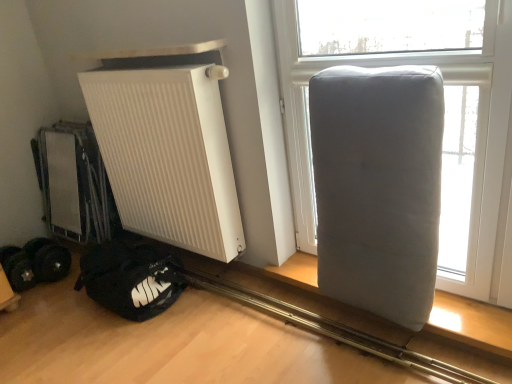
Question: Does white matte radiator at left appear on the right side of gray fabric cushion at right?

Choices:
 (A) no
 (B) yes

Answer: (A)

Question: Considering the relative sizes of white matte radiator at left and gray fabric cushion at right in the image provided, is white matte radiator at left thinner than gray fabric cushion at right?

Choices:
 (A) yes
 (B) no

Answer: (B)

Question: Is gray fabric cushion at right located within white matte radiator at left?

Choices:
 (A) yes
 (B) no

Answer: (B)

Question: From a real-world perspective, does white matte radiator at left stand above gray fabric cushion at right?

Choices:
 (A) yes
 (B) no

Answer: (B)

Question: Is white matte radiator at left positioned far away from gray fabric cushion at right?

Choices:
 (A) no
 (B) yes

Answer: (A)

Question: Is white matte radiator at left smaller than gray fabric cushion at right?

Choices:
 (A) no
 (B) yes

Answer: (A)

Question: Considering the relative sizes of black rubber weights at lower left and gray fabric mattress at right in the image provided, is black rubber weights at lower left bigger than gray fabric mattress at right?

Choices:
 (A) yes
 (B) no

Answer: (B)

Question: Can you confirm if black rubber weights at lower left is shorter than gray fabric mattress at right?

Choices:
 (A) yes
 (B) no

Answer: (A)

Question: Does black rubber weights at lower left touch gray fabric mattress at right?

Choices:
 (A) yes
 (B) no

Answer: (B)

Question: Is black rubber weights at lower left turned away from gray fabric mattress at right?

Choices:
 (A) no
 (B) yes

Answer: (A)

Question: Is black rubber weights at lower left at the right side of gray fabric mattress at right?

Choices:
 (A) no
 (B) yes

Answer: (A)

Question: Can you confirm if black rubber weights at lower left is smaller than gray fabric mattress at right?

Choices:
 (A) yes
 (B) no

Answer: (A)

Question: Considering the relative sizes of gray fabric cushion at right and gray fabric mattress at right in the image provided, is gray fabric cushion at right taller than gray fabric mattress at right?

Choices:
 (A) yes
 (B) no

Answer: (A)